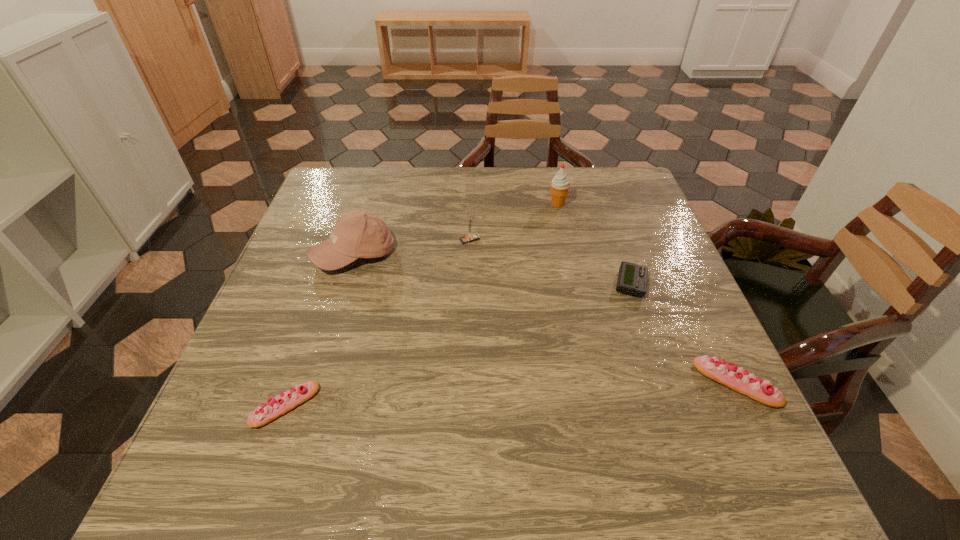
The height and width of the screenshot is (540, 960). Identify the location of free space between the left eclair and the third object from right to left. (421, 305).

Find the location of a particular element. This screenshot has width=960, height=540. free spot between the shorter eclair and the shortest object is located at coordinates click(458, 345).

Where is `free spot between the fourth object from left to right and the right eclair`? free spot between the fourth object from left to right and the right eclair is located at coordinates (647, 294).

The width and height of the screenshot is (960, 540). What are the coordinates of `vacant space that is in between the beeper and the second tallest object` in the screenshot? It's located at (492, 269).

Image resolution: width=960 pixels, height=540 pixels. I want to click on free space between the shortest object and the taller eclair, so [x=684, y=334].

Where is `blank region between the third object from left to right and the third object from right to left`? This screenshot has width=960, height=540. blank region between the third object from left to right and the third object from right to left is located at coordinates (514, 222).

Locate an element on the screen. This screenshot has width=960, height=540. free space between the baseball cap and the icecream is located at coordinates (456, 229).

Image resolution: width=960 pixels, height=540 pixels. I want to click on vacant point located between the baseball cap and the shorter eclair, so click(x=320, y=330).

You are a GUI agent. You are given a task and a screenshot of the screen. Output one action in this format:
    pyautogui.click(x=<x>, y=<y>)
    Task: Click on the free spot between the second object from right to left and the second tallest object
    This screenshot has height=540, width=960.
    Given the screenshot: What is the action you would take?
    pyautogui.click(x=492, y=269)

Identify which object is the closest to the fifth object from left to right. Please provide its 2D coordinates. Your answer should be formatted as a tuple, i.e. [(x, y)], where the tuple contains the x and y coordinates of a point satisfying the conditions above.

[(730, 375)]